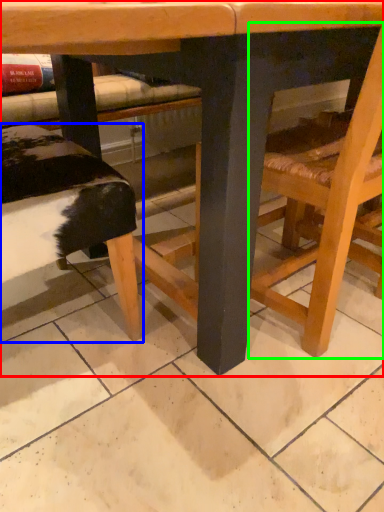
Question: Estimate the real-world distances between objects in this image. Which object is farther from table (highlighted by a red box), park bench (highlighted by a blue box) or chair (highlighted by a green box)?

Choices:
 (A) park bench
 (B) chair

Answer: (A)